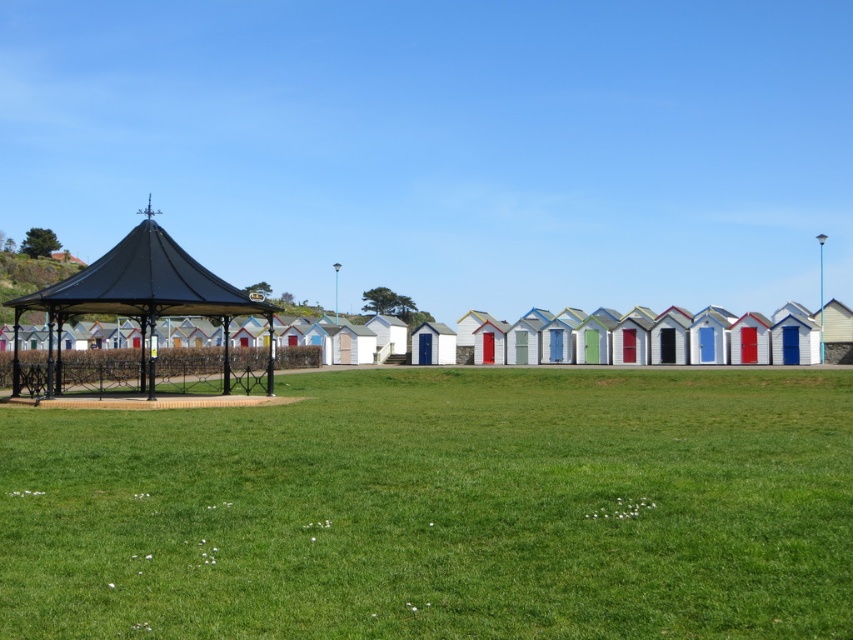
You are standing on the green grass at center and want to reach the black metal gazebo at left. Which direction should you move to get there?

You should move upward because the green grass at center is below the black metal gazebo at left.

You are standing at the edge of the green grass at center and want to walk towards the black metal gazebo at left. Which direction should you move to get closer to the gazebo?

Since the green grass at center is closer to the viewer than the black metal gazebo at left, you should move backward to get closer to the gazebo.